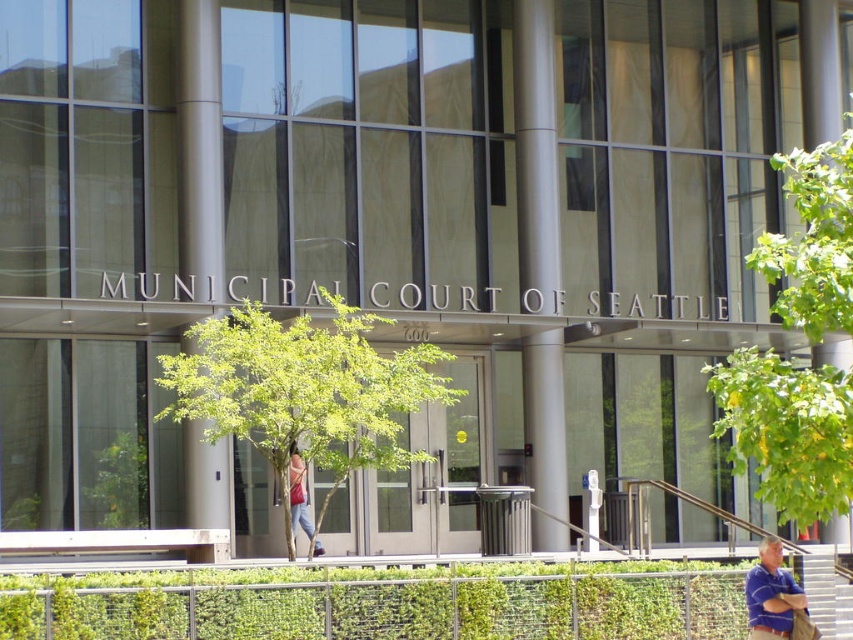
The height and width of the screenshot is (640, 853). Find the location of `green leafy tree at right`. green leafy tree at right is located at coordinates (788, 429).

Consider the image. Does green leafy tree at right appear on the left side of matte pink bag at center?

Incorrect, green leafy tree at right is not on the left side of matte pink bag at center.

Find the location of `green leafy tree at right`. green leafy tree at right is located at coordinates [788, 429].

How far apart are blue striped shirt at lower right and white plastic stairs at lower right?

The distance of blue striped shirt at lower right from white plastic stairs at lower right is 15.28 feet.

Is point (770, 568) more distant than point (815, 596)?

That is False.

This screenshot has width=853, height=640. In order to click on blue striped shirt at lower right in this screenshot , I will do `click(770, 595)`.

Between green leafy hedge at lower center and green leafy tree at center, which one is positioned lower?

green leafy hedge at lower center is below.

Does green leafy hedge at lower center have a greater height compared to green leafy tree at center?

Indeed, green leafy hedge at lower center has a greater height compared to green leafy tree at center.

I want to click on green leafy hedge at lower center, so pos(386,604).

What are the coordinates of `green leafy hedge at lower center` in the screenshot? It's located at (386, 604).